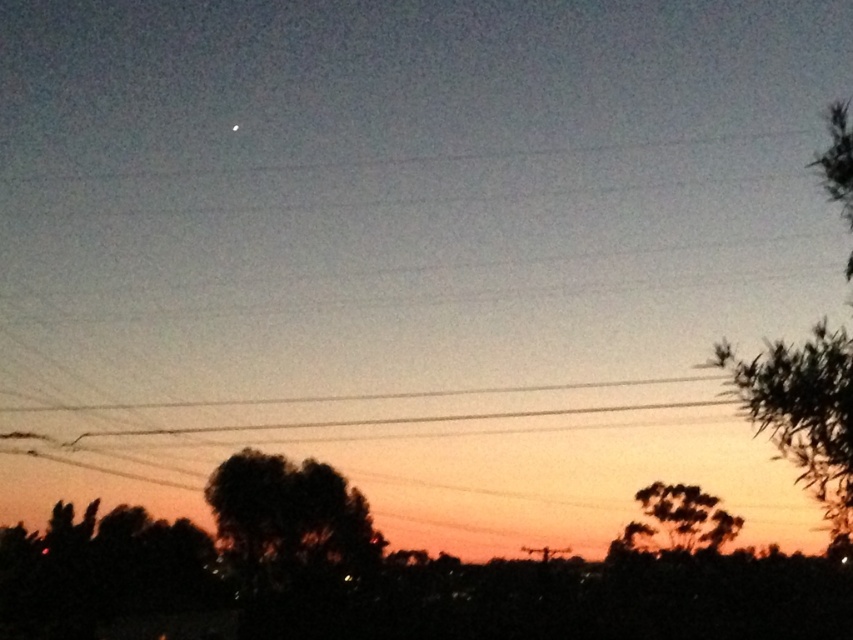
Who is lower down, dark green leafy tree at center or dark green leafy tree at lower right?

dark green leafy tree at lower right is below.

Is point (276, 529) positioned in front of point (666, 525)?

Yes.

In order to click on dark green leafy tree at center in this screenshot , I will do [x=289, y=516].

Is green leafy tree at right wider than dark green leafy tree at lower right?

Correct, the width of green leafy tree at right exceeds that of dark green leafy tree at lower right.

Can you confirm if green leafy tree at right is bigger than dark green leafy tree at lower right?

Yes, green leafy tree at right is bigger than dark green leafy tree at lower right.

Describe the element at coordinates (804, 412) in the screenshot. I see `green leafy tree at right` at that location.

The image size is (853, 640). Find the location of `green leafy tree at right`. green leafy tree at right is located at coordinates (804, 412).

Which is below, green leafy tree at right or dark green leafy tree at center?

Positioned lower is dark green leafy tree at center.

Image resolution: width=853 pixels, height=640 pixels. Describe the element at coordinates (804, 412) in the screenshot. I see `green leafy tree at right` at that location.

In order to click on green leafy tree at right in this screenshot , I will do `click(804, 412)`.